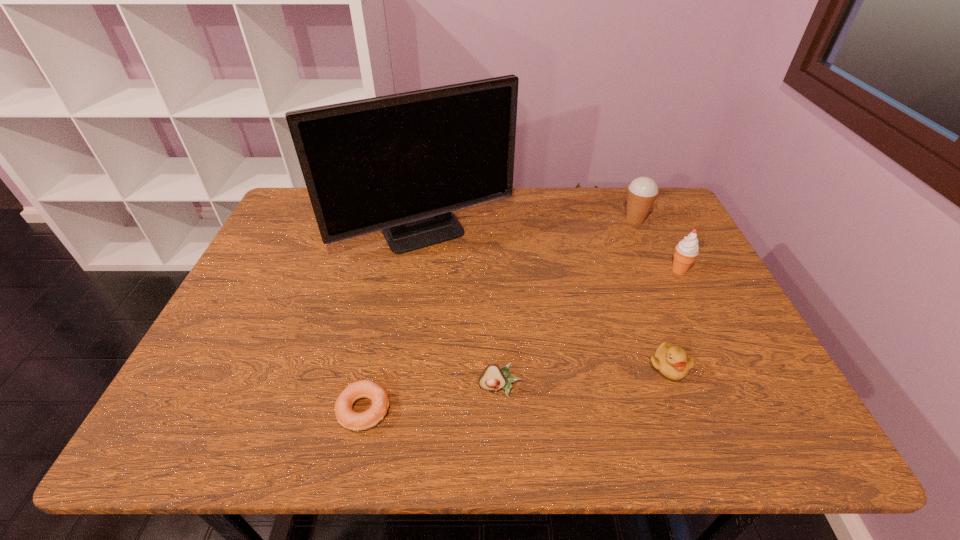
Locate an element on the screen. The image size is (960, 540). free space located at the beak of the duckling is located at coordinates (691, 427).

At what (x,y) coordinates should I click in order to perform the action: click on free space located 0.200m on the right of the bagel. Please return your answer as a coordinate pair (x, y). This screenshot has height=540, width=960. Looking at the image, I should click on (489, 410).

I want to click on computer monitor at the far edge, so click(x=401, y=163).

Find the location of `icecream present at the far edge`. icecream present at the far edge is located at coordinates (642, 192).

Where is `object that is at the near edge`? This screenshot has height=540, width=960. object that is at the near edge is located at coordinates (354, 421).

This screenshot has width=960, height=540. In order to click on object present at the far right corner in this screenshot , I will do `click(642, 192)`.

You are a GUI agent. You are given a task and a screenshot of the screen. Output one action in this format:
    pyautogui.click(x=<x>, y=<y>)
    Task: Click on the free space at the far edge of the desktop
    This screenshot has width=960, height=540.
    Given the screenshot: What is the action you would take?
    pyautogui.click(x=613, y=219)

In the image, there is a desktop. Identify the location of blank space at the near edge. This screenshot has height=540, width=960. (488, 422).

This screenshot has height=540, width=960. In order to click on vacant space at the right edge in this screenshot , I will do click(x=690, y=276).

Locate an element on the screen. The image size is (960, 540). vacant space at the far right corner is located at coordinates (656, 229).